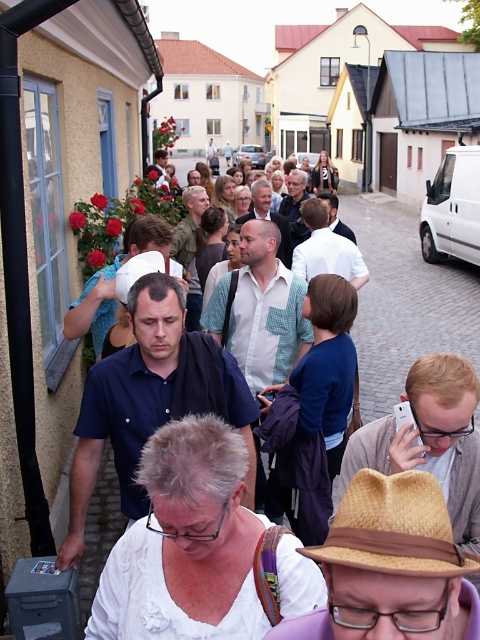
Does white cotton shirt at center have a larger size compared to brown straw hat at lower center?

Yes.

Is white cotton shirt at center taller than brown straw hat at lower center?

Correct, white cotton shirt at center is much taller as brown straw hat at lower center.

Which is in front, point (405, 333) or point (398, 506)?

Positioned in front is point (398, 506).

This screenshot has width=480, height=640. In order to click on white cotton shirt at center in this screenshot , I will do `click(405, 300)`.

How distant is brown straw hat at lower center from straw hat at center?

7.56 feet

Which is more to the right, brown straw hat at lower center or straw hat at center?

From the viewer's perspective, brown straw hat at lower center appears more on the right side.

You are a GUI agent. You are given a task and a screenshot of the screen. Output one action in this format:
    pyautogui.click(x=<x>, y=<y>)
    Task: Click on the brown straw hat at lower center
    This screenshot has height=640, width=480.
    Given the screenshot: What is the action you would take?
    pyautogui.click(x=394, y=529)

Does white cotton shirt at center have a lesser width compared to straw hat at center?

Incorrect, white cotton shirt at center's width is not less than straw hat at center's.

From the picture: Between white cotton shirt at center and straw hat at center, which one is positioned higher?

white cotton shirt at center is higher up.

Locate an element on the screen. This screenshot has height=640, width=480. white cotton shirt at center is located at coordinates tap(405, 300).